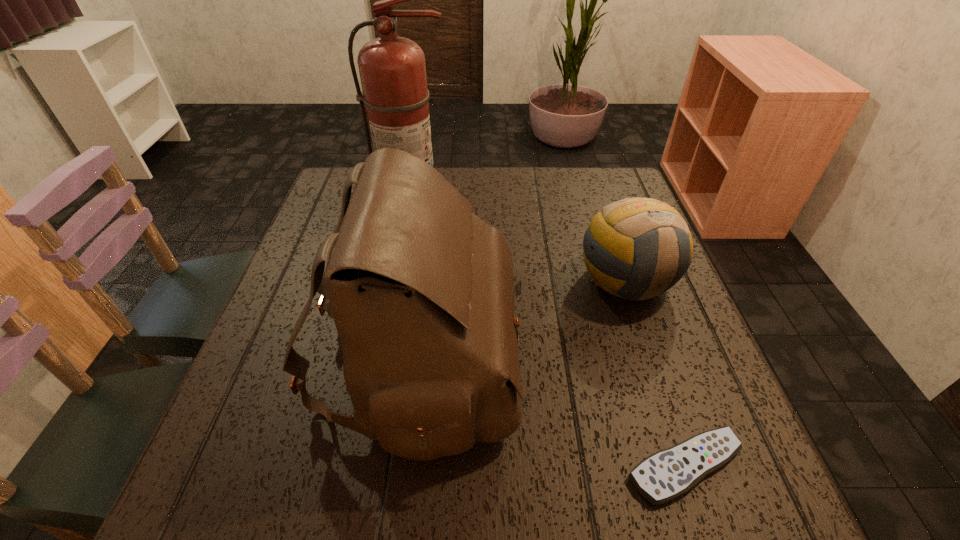
I want to click on free space at the left edge, so click(327, 263).

Image resolution: width=960 pixels, height=540 pixels. Identify the location of vacant space at the right edge of the desktop. (673, 318).

The width and height of the screenshot is (960, 540). Find the location of `vacant point located between the remote control and the second tallest object`. vacant point located between the remote control and the second tallest object is located at coordinates (551, 414).

Image resolution: width=960 pixels, height=540 pixels. I want to click on vacant area that lies between the second shortest object and the remote control, so click(655, 373).

Where is `vacant space that is in between the remote control and the satchel`? The width and height of the screenshot is (960, 540). vacant space that is in between the remote control and the satchel is located at coordinates (551, 414).

At what (x,y) coordinates should I click in order to perform the action: click on free space between the second tallest object and the volleyball. Please return your answer as a coordinate pair (x, y). The width and height of the screenshot is (960, 540). Looking at the image, I should click on (522, 321).

At what (x,y) coordinates should I click in order to perform the action: click on empty location between the third tallest object and the tallest object. Please return your answer as a coordinate pair (x, y). Looking at the image, I should click on (519, 246).

The image size is (960, 540). In order to click on free spot between the third tallest object and the fire extinguisher in this screenshot , I will do `click(519, 246)`.

Where is `free area in between the farthest object and the second shortest object`? free area in between the farthest object and the second shortest object is located at coordinates (519, 246).

Identify the location of vacant point located between the volleyball and the fire extinguisher. This screenshot has height=540, width=960. (519, 246).